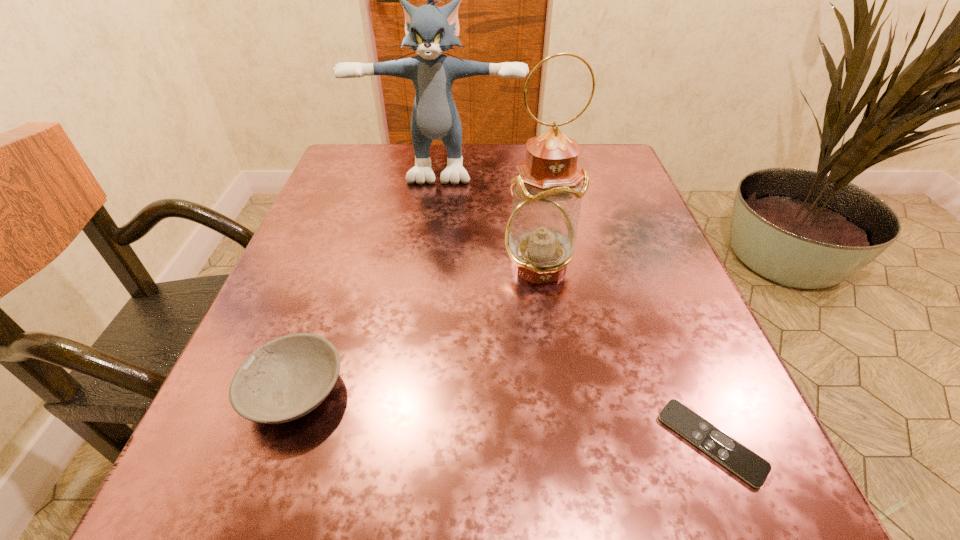
Identify the location of vacant space at the far left corner of the desktop. The height and width of the screenshot is (540, 960). (365, 178).

Where is `free location at the far right corner of the desktop`? free location at the far right corner of the desktop is located at coordinates (582, 147).

At what (x,y) coordinates should I click in order to perform the action: click on free space between the remote control and the third nearest object. Please return your answer as a coordinate pair (x, y). Looking at the image, I should click on (625, 354).

Identify the location of empty location between the shortest object and the bowl. (503, 417).

At what (x,y) coordinates should I click in order to perform the action: click on vacant area that lies between the oil lamp and the shortest object. Please return your answer as a coordinate pair (x, y). The height and width of the screenshot is (540, 960). Looking at the image, I should click on (625, 354).

Where is `free space between the rightmost object and the second farthest object`? Image resolution: width=960 pixels, height=540 pixels. free space between the rightmost object and the second farthest object is located at coordinates (625, 354).

Image resolution: width=960 pixels, height=540 pixels. Find the location of `free space between the bowl and the shortest object`. free space between the bowl and the shortest object is located at coordinates (503, 417).

In order to click on free space between the oil lamp and the bowl in this screenshot , I will do `click(417, 328)`.

You are a GUI agent. You are given a task and a screenshot of the screen. Output one action in this format:
    pyautogui.click(x=<x>, y=<y>)
    Task: Click on the vacant area that lies between the oil lamp and the bowl
    The width and height of the screenshot is (960, 540).
    Given the screenshot: What is the action you would take?
    pyautogui.click(x=417, y=328)

You are a GUI agent. You are given a task and a screenshot of the screen. Output one action in this format:
    pyautogui.click(x=<x>, y=<y>)
    Task: Click on the free spot between the cat and the shortest object
    This screenshot has height=540, width=960.
    Given the screenshot: What is the action you would take?
    pyautogui.click(x=576, y=303)